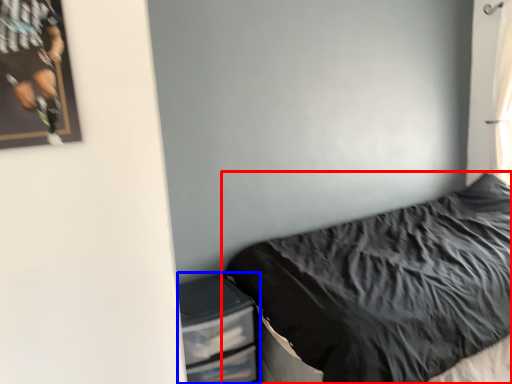
Question: Among these objects, which one is farthest to the camera, bed (highlighted by a red box) or dresser (highlighted by a blue box)?

Choices:
 (A) bed
 (B) dresser

Answer: (B)